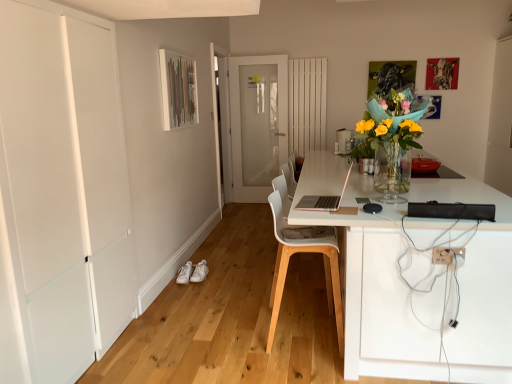
Identify the location of vacant area on top of white frosted glass door at center, positioned as the 1th door in right-to-left order (from a real-world perspective). This screenshot has height=384, width=512. (256, 55).